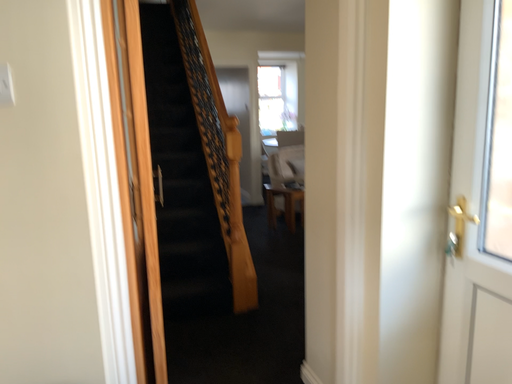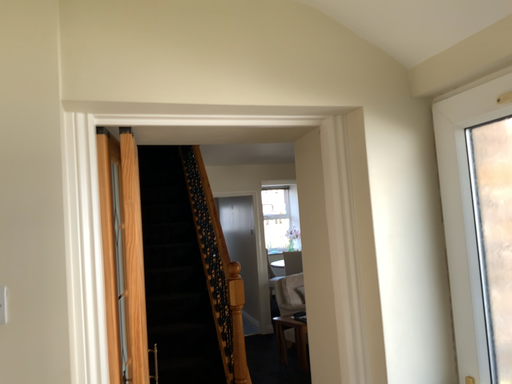
Question: How did the camera likely rotate when shooting the video?

Choices:
 (A) rotated upward
 (B) rotated downward

Answer: (A)